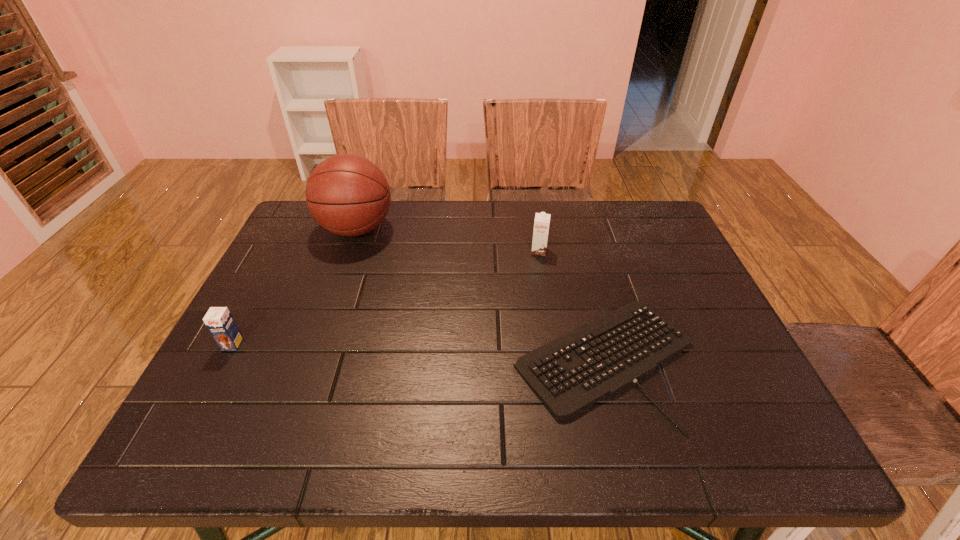
At what (x,y) coordinates should I click in order to perform the action: click on blank region between the basketball and the nearer chocolate milk. Please return your answer as a coordinate pair (x, y). Looking at the image, I should click on (295, 287).

The width and height of the screenshot is (960, 540). Identify the location of free spot between the farther chocolate milk and the shortest object. pyautogui.click(x=572, y=306).

Locate an element on the screen. This screenshot has height=540, width=960. vacant space that's between the second object from left to right and the farther chocolate milk is located at coordinates (447, 240).

This screenshot has width=960, height=540. Find the location of `free space between the farther chocolate milk and the shortest object`. free space between the farther chocolate milk and the shortest object is located at coordinates 572,306.

Find the location of `unoccupied position between the farther chocolate milk and the leftmost object`. unoccupied position between the farther chocolate milk and the leftmost object is located at coordinates (386, 298).

Identify which object is the third closest to the left chocolate milk. Please provide its 2D coordinates. Your answer should be formatted as a tuple, i.e. [(x, y)], where the tuple contains the x and y coordinates of a point satisfying the conditions above.

[(541, 224)]

Choose which object is the second nearest neighbor to the farther chocolate milk. Please provide its 2D coordinates. Your answer should be formatted as a tuple, i.e. [(x, y)], where the tuple contains the x and y coordinates of a point satisfying the conditions above.

[(348, 195)]